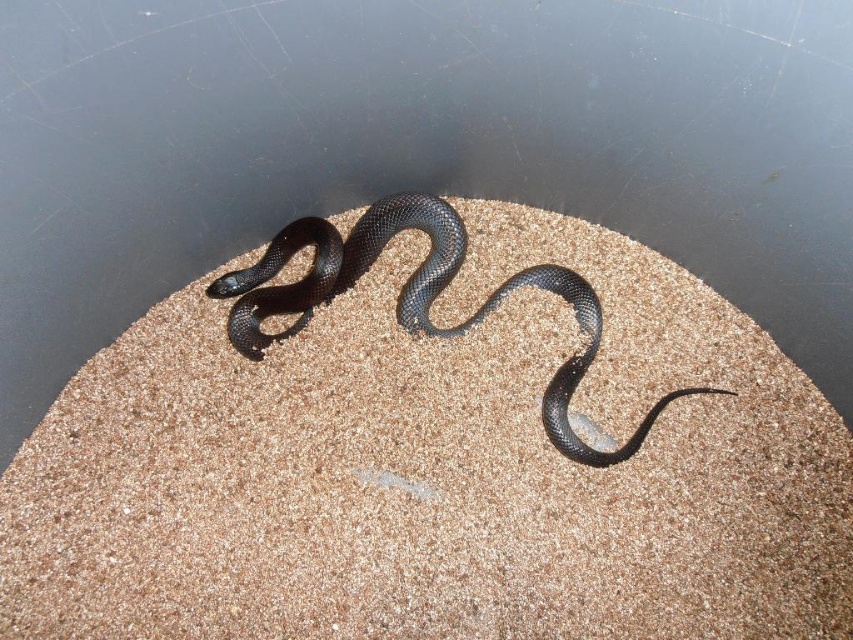
Question: Is brown textured sand at center further to the viewer compared to shiny black snake at center?

Choices:
 (A) yes
 (B) no

Answer: (B)

Question: Considering the relative positions of brown textured sand at center and shiny black snake at center in the image provided, where is brown textured sand at center located with respect to shiny black snake at center?

Choices:
 (A) below
 (B) above

Answer: (A)

Question: Among these points, which one is nearest to the camera?

Choices:
 (A) (426, 205)
 (B) (381, 636)

Answer: (B)

Question: Which object appears farthest from the camera in this image?

Choices:
 (A) shiny black snake at center
 (B) brown textured sand at center

Answer: (A)

Question: Does brown textured sand at center appear on the left side of shiny black snake at center?

Choices:
 (A) yes
 (B) no

Answer: (A)